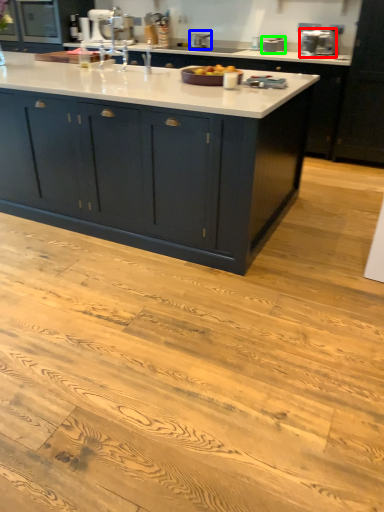
Question: Which object is positioned closest to appliance (highlighted by a red box)? Select from appliance (highlighted by a blue box) and appliance (highlighted by a green box).

Choices:
 (A) appliance
 (B) appliance

Answer: (B)